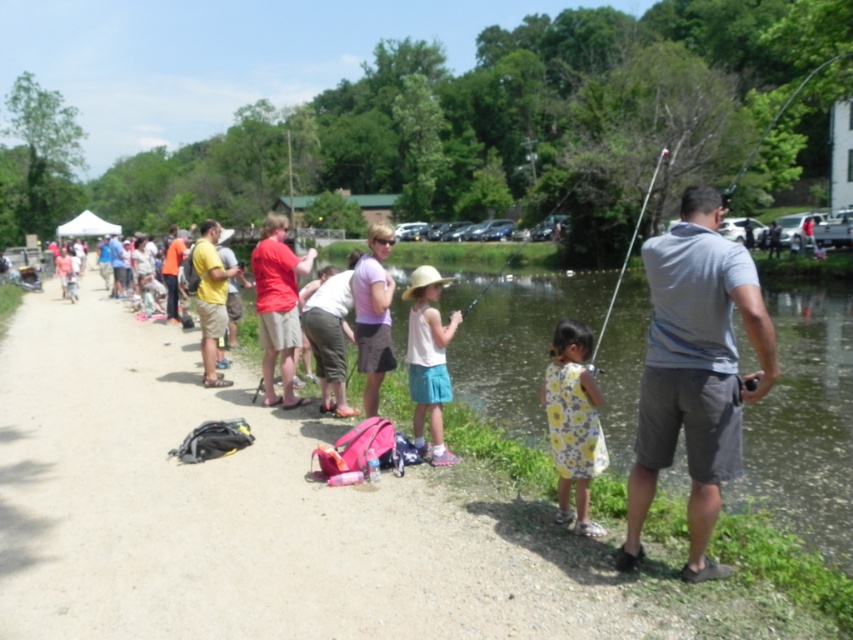
You are a photographer at the community fishing event. You want to take a photo that includes both the yellow floral dress at lower center and the white cotton shirt at center. Which of the two should you focus on first if you want to capture the larger subject in the frame?

The white cotton shirt at center is larger than the yellow floral dress at lower center, so you should focus on the white cotton shirt at center first to capture the larger subject in the frame.

Based on the photo, you are a photographer at the community fishing event. You want to capture a photo that includes both the yellow floral dress at lower center and the white cotton shirt at center. Based on their positions, which object should you focus on first to ensure both are in frame?

The yellow floral dress at lower center is located below the white cotton shirt at center, so you should focus on the white cotton shirt at center first to ensure both are in the frame.